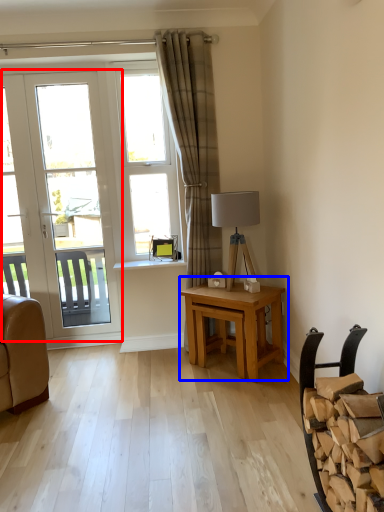
Question: Which of the following is the farthest to the observer, door (highlighted by a red box) or table (highlighted by a blue box)?

Choices:
 (A) door
 (B) table

Answer: (A)